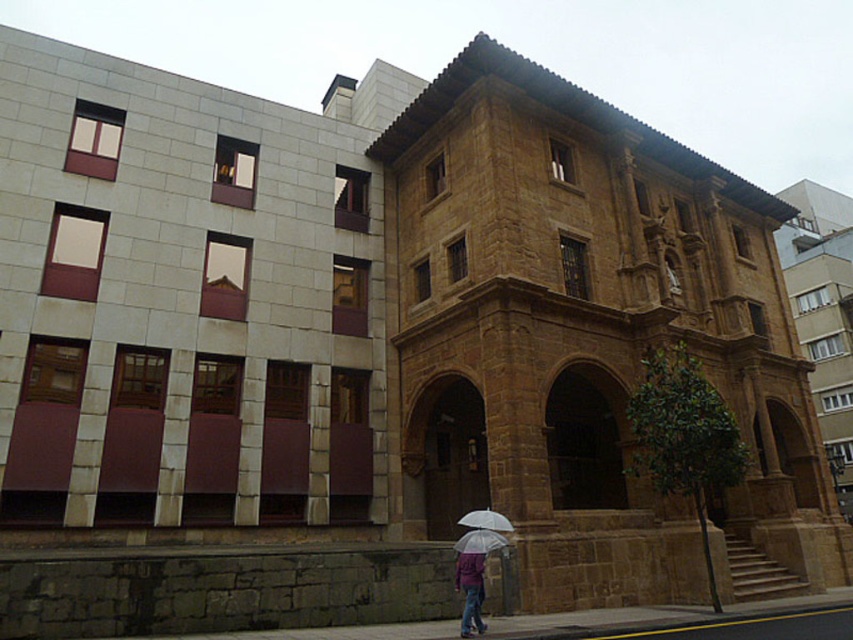
You are a delivery person carrying a package that is 1.2 meters wide. You need to pass through the space between the purple matte jacket at lower center and the white matte umbrella at center. Can your package fit through that space?

The purple matte jacket at lower center is narrower than the white matte umbrella at center. However, the total width available between them isn t specified in the objects description. The description only states the jacket s width is less than the umbrella s. Without knowing the exact distance between them or the combined space, it s impossible to determine if the 1.2 meter wide package can fit through the space between them.

You are a customer at a store that sells umbrellas. You want to choose an umbrella that can cover a large area. Which one between the transparent plastic umbrella at center and the white matte umbrella at center would you recommend?

The white matte umbrella at center has a greater width than the transparent plastic umbrella at center, so it would be better for covering a large area.

You are a delivery person who needs to place a package on a surface between the purple matte jacket at lower center and the transparent plastic umbrella at center. Which object should you place the package closer to if the package is taller than the umbrella but shorter than the jacket?

The package should be placed closer to the transparent plastic umbrella at center because the purple matte jacket at lower center is taller than the transparent plastic umbrella at center, and the package is shorter than the jacket but taller than the umbrella. This ensures the package is between them in height.